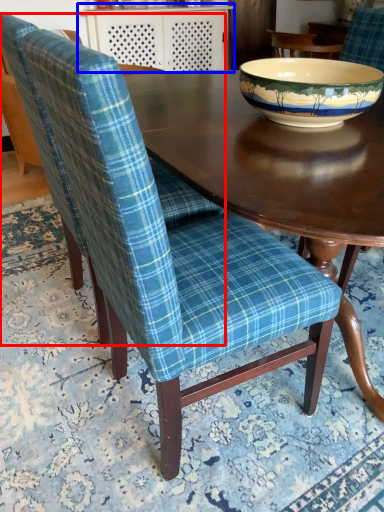
Question: Among these objects, which one is nearest to the camera, chair (highlighted by a red box) or table (highlighted by a blue box)?

Choices:
 (A) chair
 (B) table

Answer: (A)